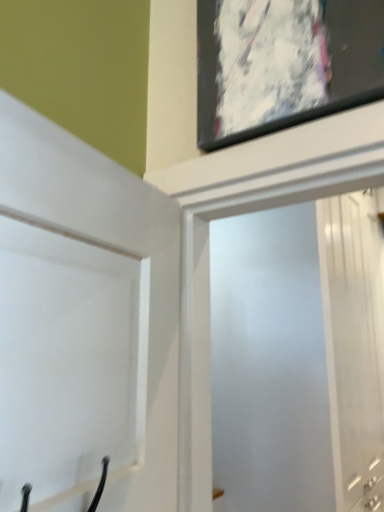
Question: In the image, is white matte door at upper left positioned in front of or behind frosted glass screen door at upper center?

Choices:
 (A) behind
 (B) front

Answer: (B)

Question: From a real-world perspective, relative to frosted glass screen door at upper center, is white matte door at upper left vertically above or below?

Choices:
 (A) below
 (B) above

Answer: (A)

Question: Is white matte door at upper left bigger or smaller than frosted glass screen door at upper center?

Choices:
 (A) small
 (B) big

Answer: (A)

Question: From a real-world perspective, is frosted glass screen door at upper center positioned above or below white matte door at upper left?

Choices:
 (A) above
 (B) below

Answer: (A)

Question: Considering the positions of frosted glass screen door at upper center and white matte door at upper left in the image, is frosted glass screen door at upper center taller or shorter than white matte door at upper left?

Choices:
 (A) tall
 (B) short

Answer: (A)

Question: Choose the correct answer: Is frosted glass screen door at upper center inside white matte door at upper left or outside it?

Choices:
 (A) outside
 (B) inside

Answer: (A)

Question: In terms of width, does frosted glass screen door at upper center look wider or thinner when compared to white matte door at upper left?

Choices:
 (A) thin
 (B) wide

Answer: (B)